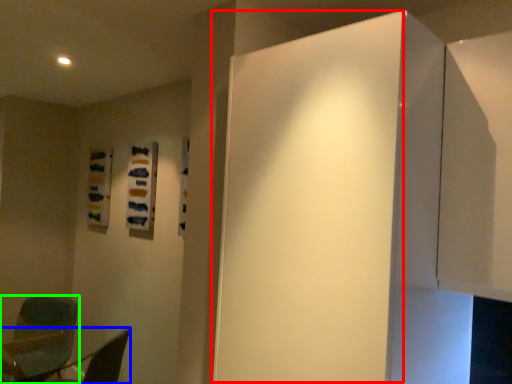
Question: Which object is the farthest from door (highlighted by a red box)? Choose among these: furniture (highlighted by a blue box) or chair (highlighted by a green box).

Choices:
 (A) furniture
 (B) chair

Answer: (B)